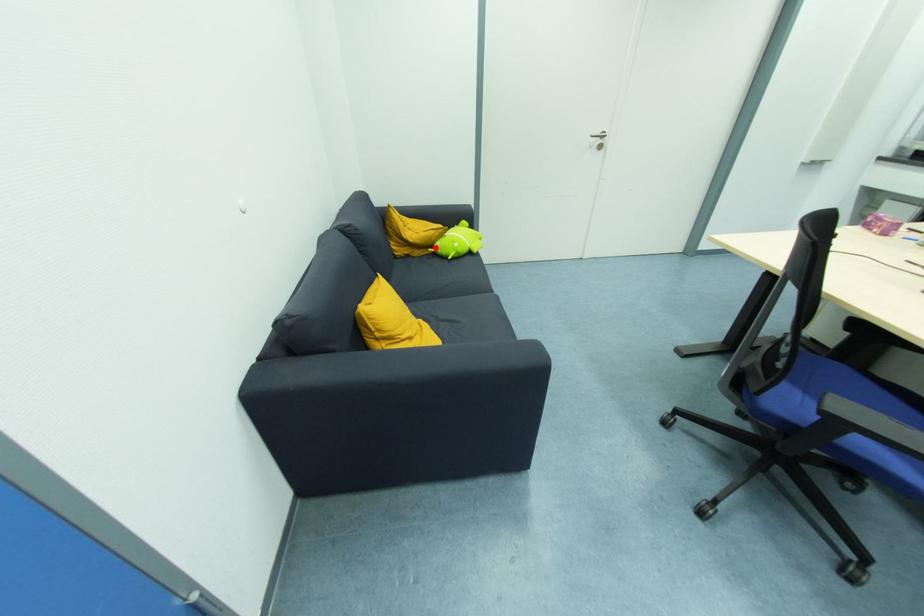
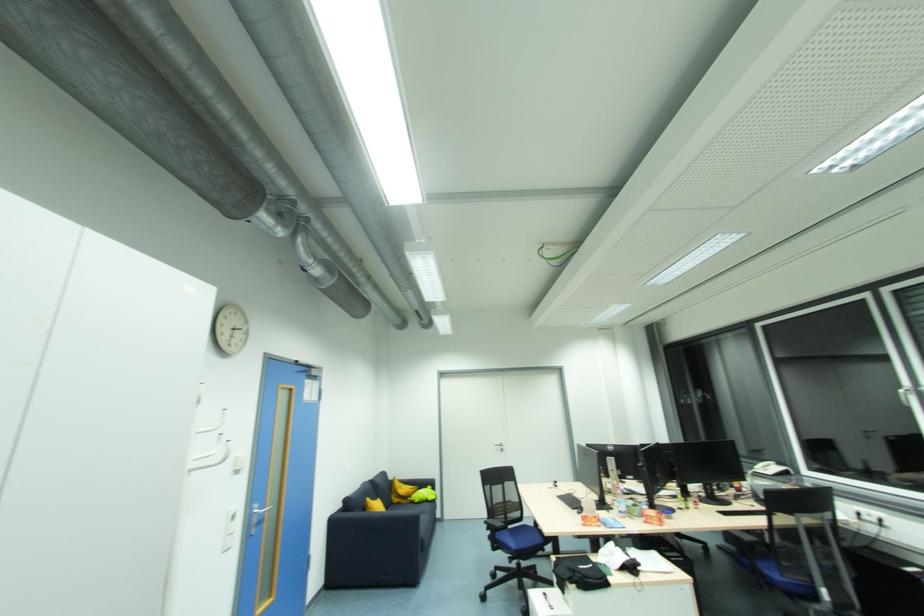
Question: I am providing you with two images of the same scene from different viewpoints. Given a red point in image1, look at the same physical point in image2. Is it:

Choices:
 (A) Closer to the viewpoint
 (B) Farther from the viewpoint

Answer: (B)